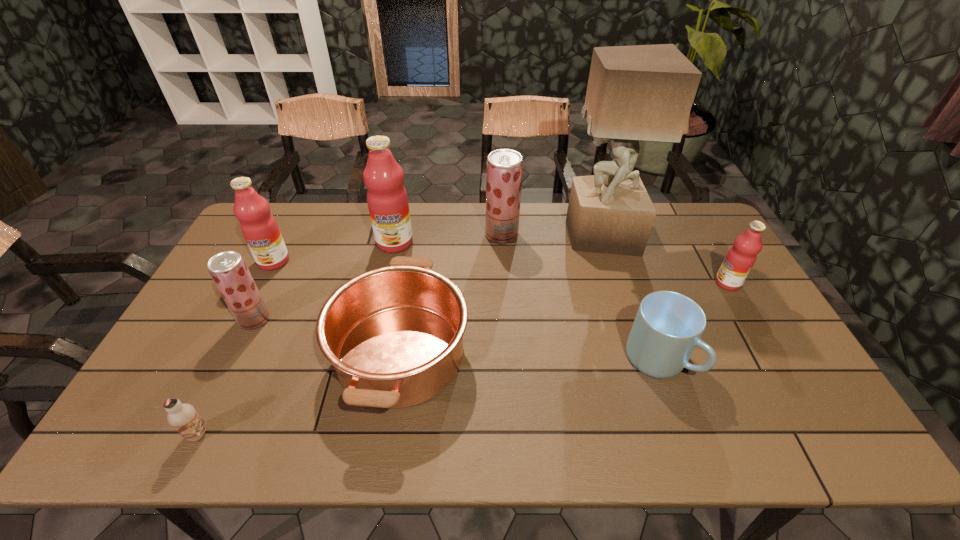
Image resolution: width=960 pixels, height=540 pixels. I want to click on sculpture, so click(x=636, y=93).

Where is `the tallest object`? the tallest object is located at coordinates (636, 93).

This screenshot has height=540, width=960. I want to click on the third fruit juice from left to right, so click(x=387, y=199).

The height and width of the screenshot is (540, 960). I want to click on the second pink fruit juice from right to left, so coord(387,199).

Locate an element on the screen. The height and width of the screenshot is (540, 960). the right strawberry fruit juice is located at coordinates (504, 167).

Locate an element on the screen. the fourth fruit juice from left to right is located at coordinates (504, 167).

This screenshot has height=540, width=960. In order to click on the second biggest pink fruit juice in this screenshot , I will do `click(259, 227)`.

Image resolution: width=960 pixels, height=540 pixels. Identify the location of the smallest pink fruit juice. (741, 257).

You are a GUI agent. You are given a task and a screenshot of the screen. Output one action in this format:
    pyautogui.click(x=<x>, y=<y>)
    Task: Click on the rightmost fruit juice
    Image resolution: width=960 pixels, height=540 pixels.
    Given the screenshot: What is the action you would take?
    pyautogui.click(x=741, y=257)

Find the location of a particular element. Image resolution: width=960 pixels, height=540 pixels. the nearer strawberry fruit juice is located at coordinates [228, 269].